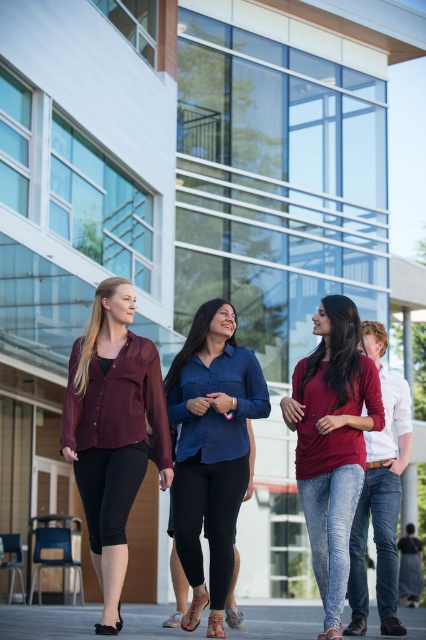
Between point (190, 538) and point (391, 556), which one is positioned behind?

Positioned behind is point (391, 556).

Is navy blue shirt at center bigger than jeans at center?

Correct, navy blue shirt at center is larger in size than jeans at center.

Find the location of `navy blue shirt at center`. navy blue shirt at center is located at coordinates (210, 449).

Based on the photo, can you confirm if matte burgundy blouse at center is wider than navy blue shirt at center?

Correct, the width of matte burgundy blouse at center exceeds that of navy blue shirt at center.

Is matte burgundy blouse at center to the right of navy blue shirt at center from the viewer's perspective?

Incorrect, matte burgundy blouse at center is not on the right side of navy blue shirt at center.

Who is more distant from viewer, (111, 628) or (244, 364)?

Point (244, 364)

Where is `matte burgundy blouse at center`? matte burgundy blouse at center is located at coordinates (112, 429).

Can you confirm if matte burgundy blouse at center is shorter than matte red shirt at center?

In fact, matte burgundy blouse at center may be taller than matte red shirt at center.

Does matte burgundy blouse at center have a smaller size compared to matte red shirt at center?

Indeed, matte burgundy blouse at center has a smaller size compared to matte red shirt at center.

Is point (77, 454) positioned behind point (296, 388)?

No.

Where is `matte burgundy blouse at center`? matte burgundy blouse at center is located at coordinates (112, 429).